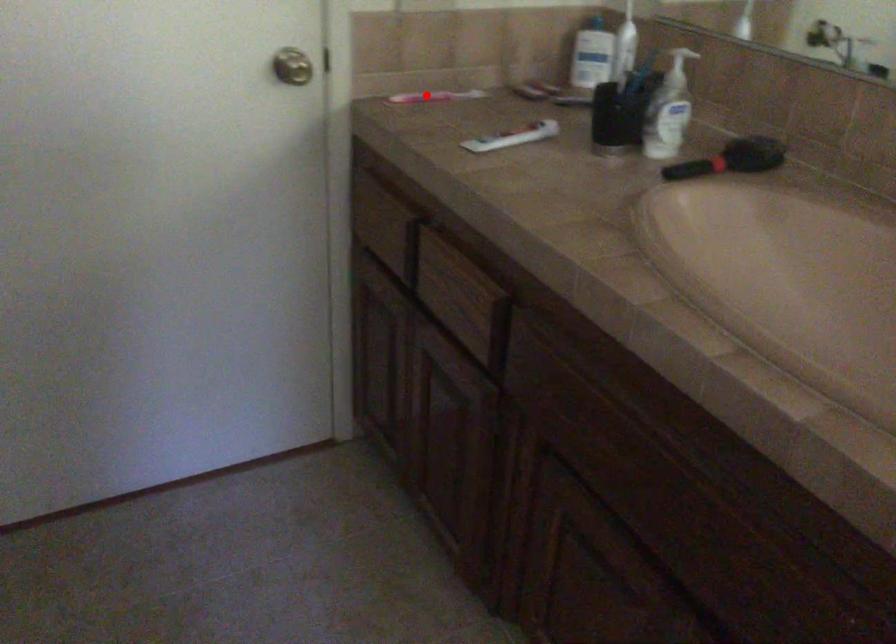
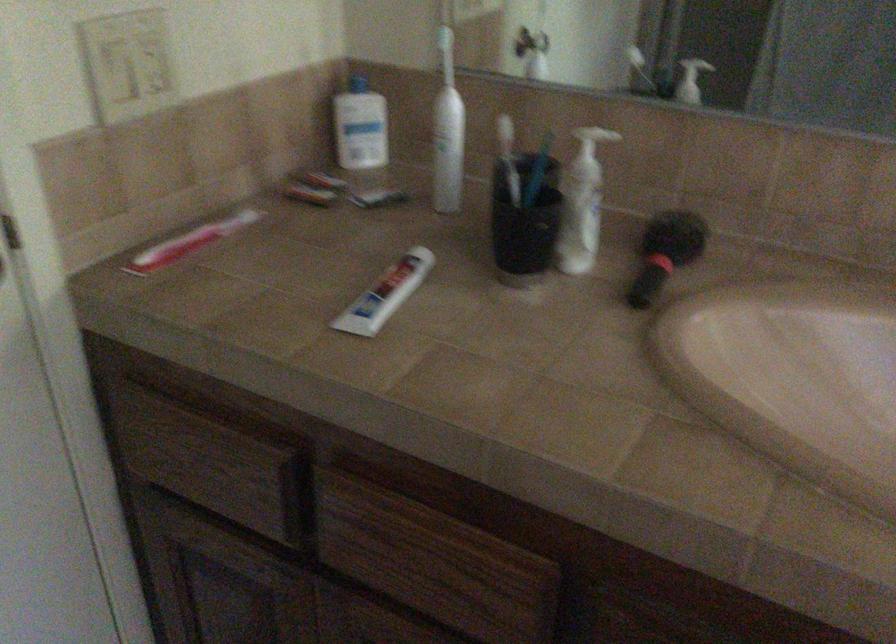
Question: I am providing you with two images of the same scene from different viewpoints. Given a red point in image1, look at the same physical point in image2. Is it:

Choices:
 (A) Closer to the viewpoint
 (B) Farther from the viewpoint

Answer: (A)